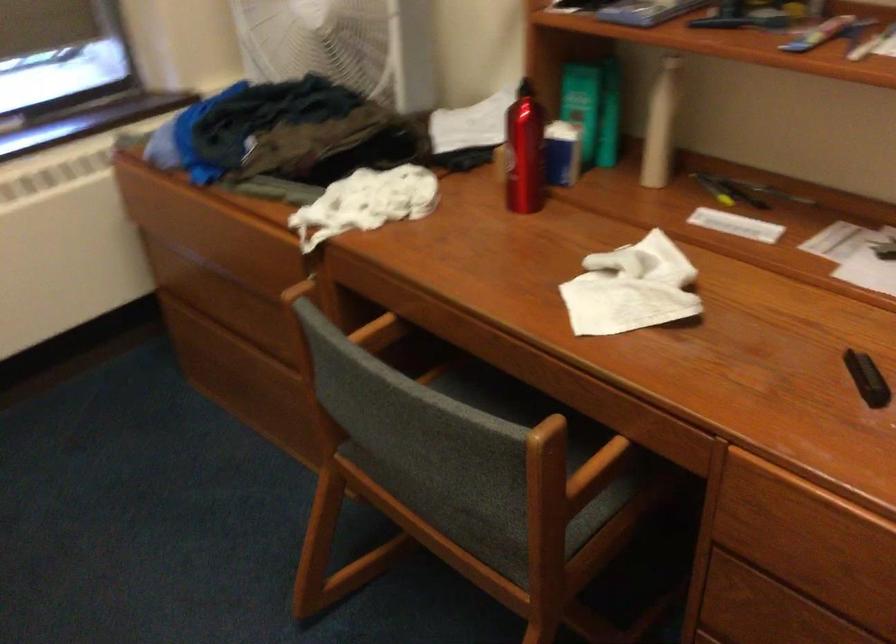
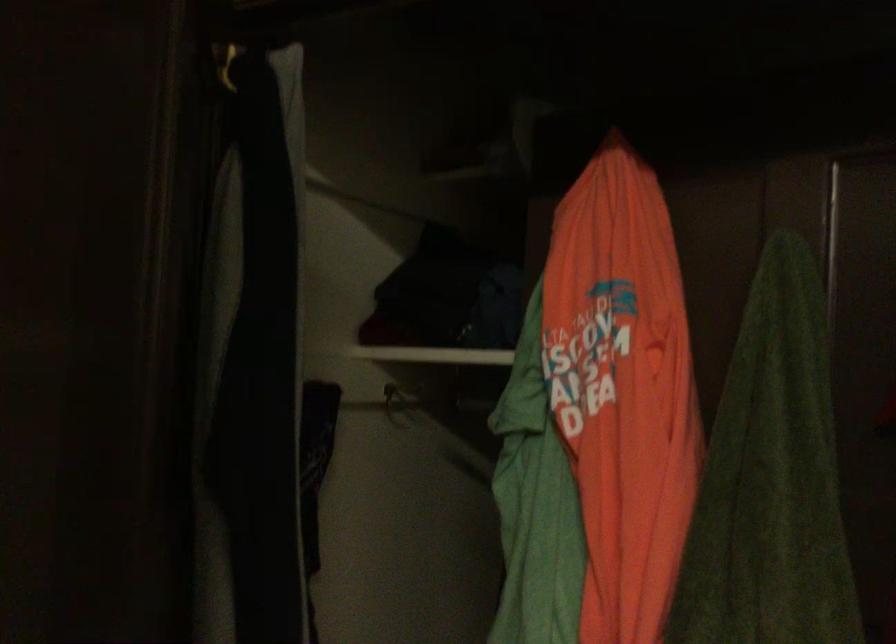
Question: Based on the continuous images, in which direction is the camera rotating? Reply with the corresponding letter.

Choices:
 (A) Left
 (B) Right
 (C) Up
 (D) Down

Answer: (B)